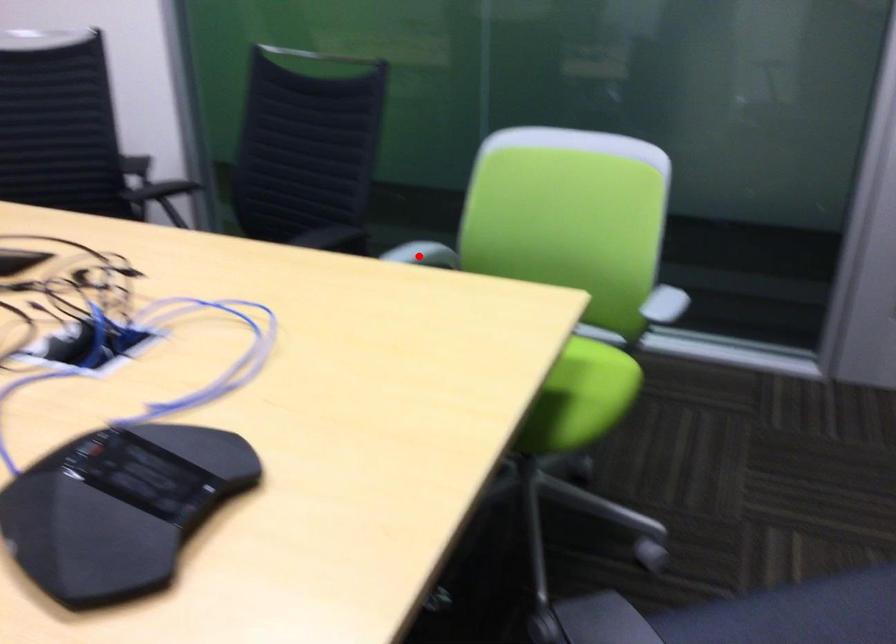
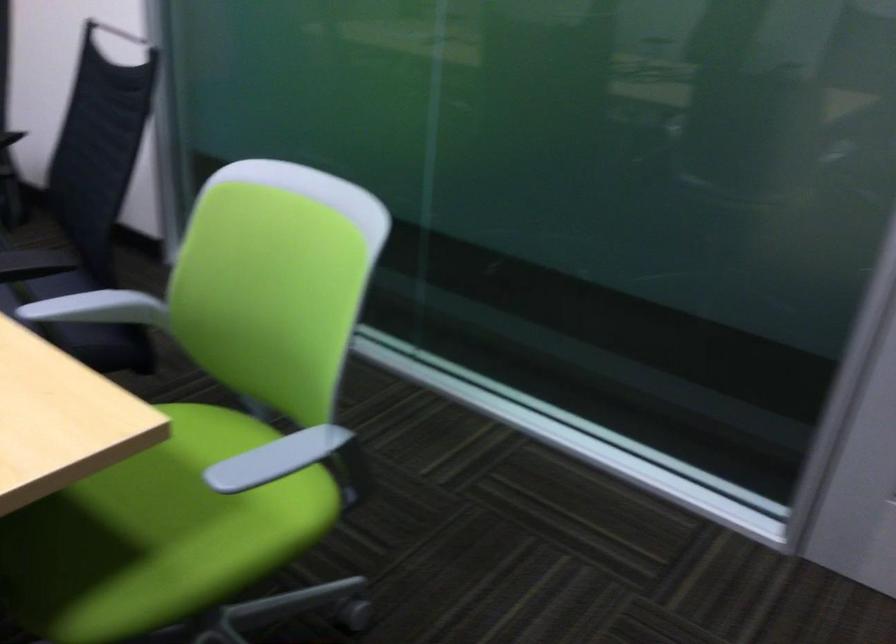
Question: I am providing you with two images of the same scene from different viewpoints. A red point is shown in image1. For the corresponding object point in image2, is it positioned nearer or farther from the camera?

Choices:
 (A) Nearer
 (B) Farther

Answer: (A)